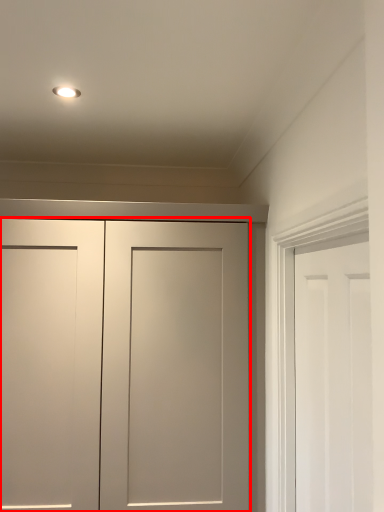
Question: From the image's perspective, what is the correct spatial relationship of door (annotated by the red box) in relation to door?

Choices:
 (A) below
 (B) above

Answer: (A)